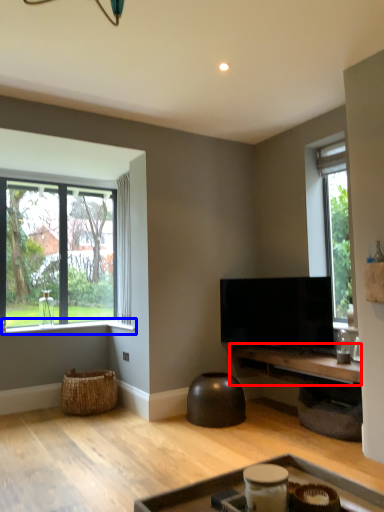
Question: Which of the following is the farthest to the observer, table (highlighted by a red box) or window sill (highlighted by a blue box)?

Choices:
 (A) table
 (B) window sill

Answer: (B)